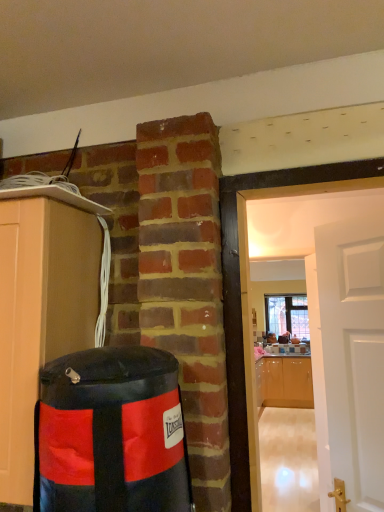
Question: Can you confirm if glossy wood cabinets at right, which ranks as the second cabinetry in top-to-bottom order, is bigger than matte wood cabinet at left, the 1th cabinetry viewed from the top?

Choices:
 (A) no
 (B) yes

Answer: (B)

Question: Is glossy wood cabinets at right, which ranks as the second cabinetry in left-to-right order, to the right of matte wood cabinet at left, which ranks as the second cabinetry in back-to-front order, from the viewer's perspective?

Choices:
 (A) yes
 (B) no

Answer: (A)

Question: Does glossy wood cabinets at right, which is the first cabinetry from back to front, appear on the left side of matte wood cabinet at left, which is counted as the 1th cabinetry, starting from the left?

Choices:
 (A) yes
 (B) no

Answer: (B)

Question: Considering the relative sizes of glossy wood cabinets at right, which ranks as the second cabinetry in left-to-right order, and matte wood cabinet at left, the first cabinetry in the front-to-back sequence, in the image provided, is glossy wood cabinets at right, which ranks as the second cabinetry in left-to-right order, shorter than matte wood cabinet at left, the first cabinetry in the front-to-back sequence,?

Choices:
 (A) yes
 (B) no

Answer: (B)

Question: From a real-world perspective, is glossy wood cabinets at right, which ranks as the second cabinetry in left-to-right order, located higher than matte wood cabinet at left, the 1th cabinetry viewed from the top?

Choices:
 (A) no
 (B) yes

Answer: (A)

Question: Is glossy wood cabinets at right, placed as the 2th cabinetry when sorted from front to back, facing away from matte wood cabinet at left, the first cabinetry in the front-to-back sequence?

Choices:
 (A) yes
 (B) no

Answer: (B)

Question: From the image's perspective, is matte wood cabinet at left, which is counted as the 1th cabinetry, starting from the left, above black vinyl punching bag at left?

Choices:
 (A) no
 (B) yes

Answer: (B)

Question: Is matte wood cabinet at left, the 1th cabinetry viewed from the top, further to camera compared to black vinyl punching bag at left?

Choices:
 (A) yes
 (B) no

Answer: (A)

Question: Is matte wood cabinet at left, the 1th cabinetry viewed from the top, bigger than black vinyl punching bag at left?

Choices:
 (A) no
 (B) yes

Answer: (B)

Question: Can you confirm if matte wood cabinet at left, the 2th cabinetry in the right-to-left sequence, is thinner than black vinyl punching bag at left?

Choices:
 (A) no
 (B) yes

Answer: (A)

Question: From the image's perspective, would you say matte wood cabinet at left, the 1th cabinetry viewed from the top, is shown under black vinyl punching bag at left?

Choices:
 (A) yes
 (B) no

Answer: (B)

Question: Considering the relative positions of matte wood cabinet at left, which ranks as the second cabinetry in back-to-front order, and black vinyl punching bag at left in the image provided, is matte wood cabinet at left, which ranks as the second cabinetry in back-to-front order, to the left of black vinyl punching bag at left from the viewer's perspective?

Choices:
 (A) no
 (B) yes

Answer: (B)

Question: Can you confirm if clear glass window at center is taller than glossy wood cabinets at right, which ranks as the second cabinetry in left-to-right order?

Choices:
 (A) no
 (B) yes

Answer: (A)